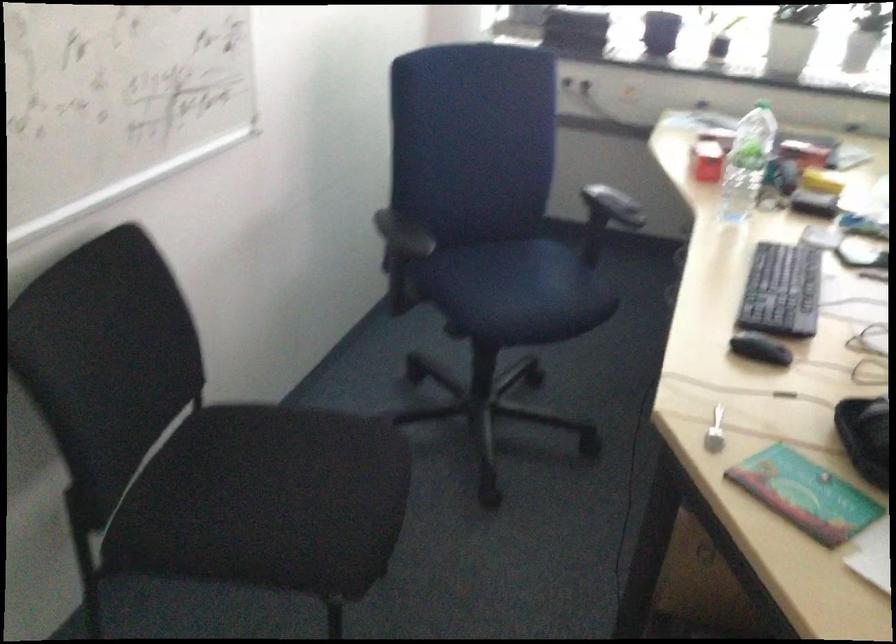
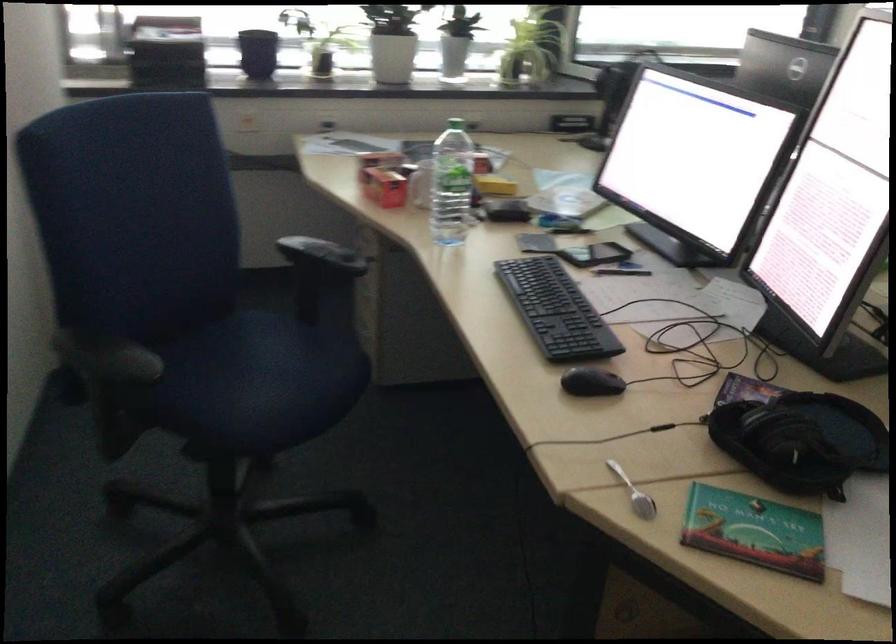
Locate, in the second image, the point that corresponds to point (507, 270) in the first image.

(245, 365)